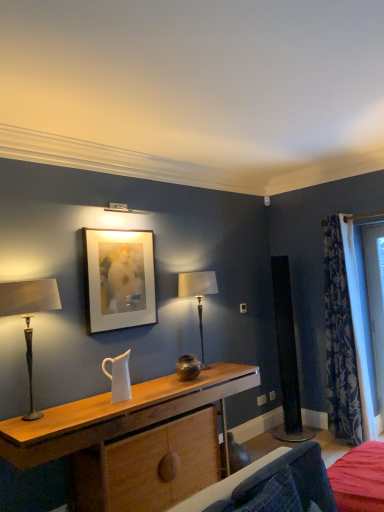
You are a GUI agent. You are given a task and a screenshot of the screen. Output one action in this format:
    pyautogui.click(x=<x>, y=<y>)
    Task: Click on the empty space that is ontop of matte white picture frame at upper center (from a real-world perspective)
    Image resolution: width=384 pixels, height=512 pixels.
    Given the screenshot: What is the action you would take?
    pyautogui.click(x=119, y=225)